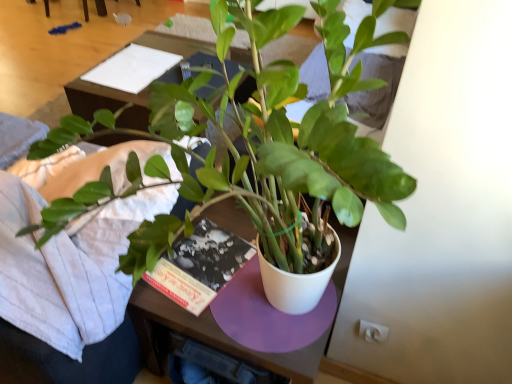
Identify the location of empty space that is ontop of white paper at upper center (from a real-world perspective). (130, 63).